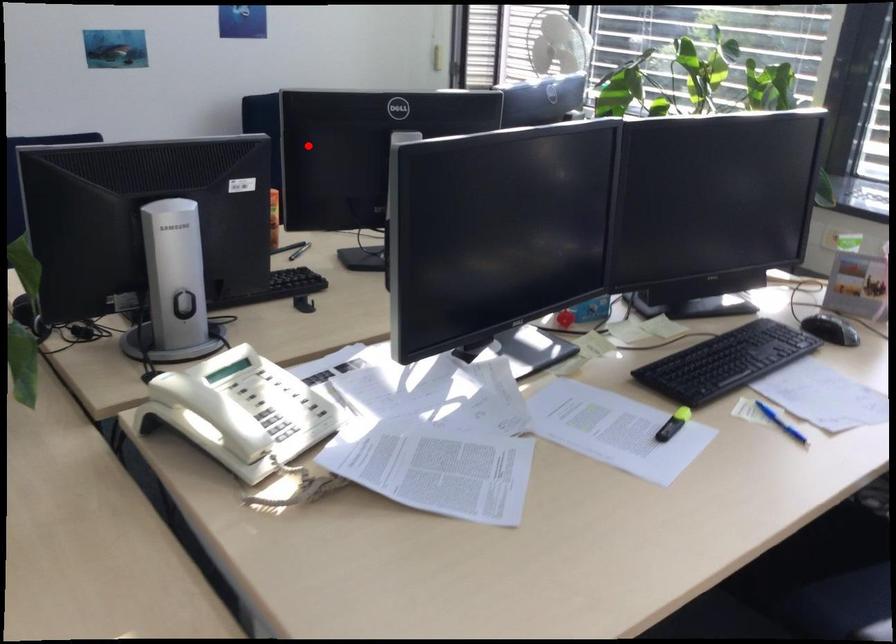
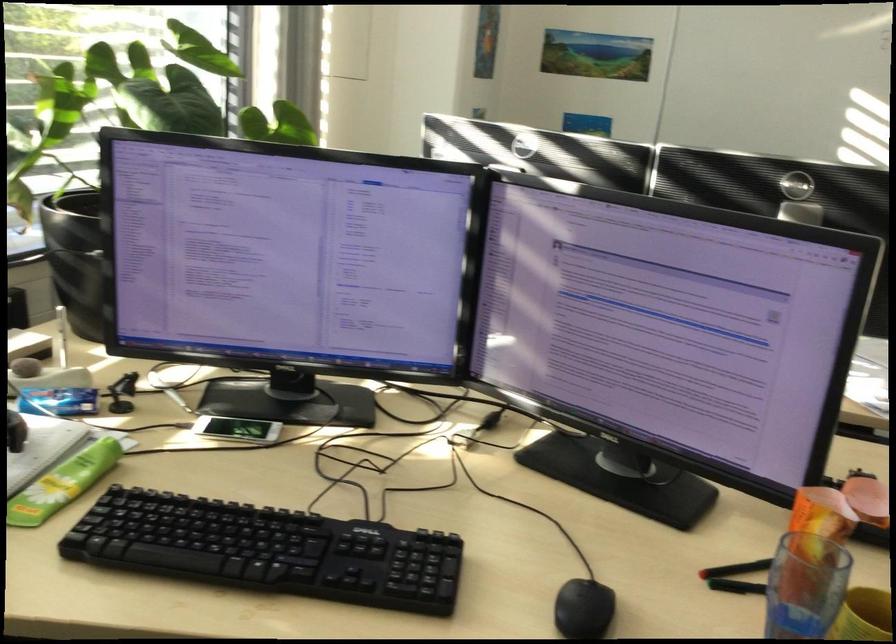
Locate, in the second image, the point that corresponds to the highlighted location in the first image.

(826, 328)